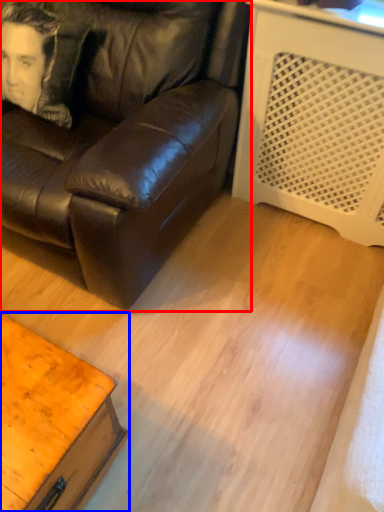
Question: Which point is closer to the camera, studio couch (highlighted by a red box) or table (highlighted by a blue box)?

Choices:
 (A) studio couch
 (B) table

Answer: (B)